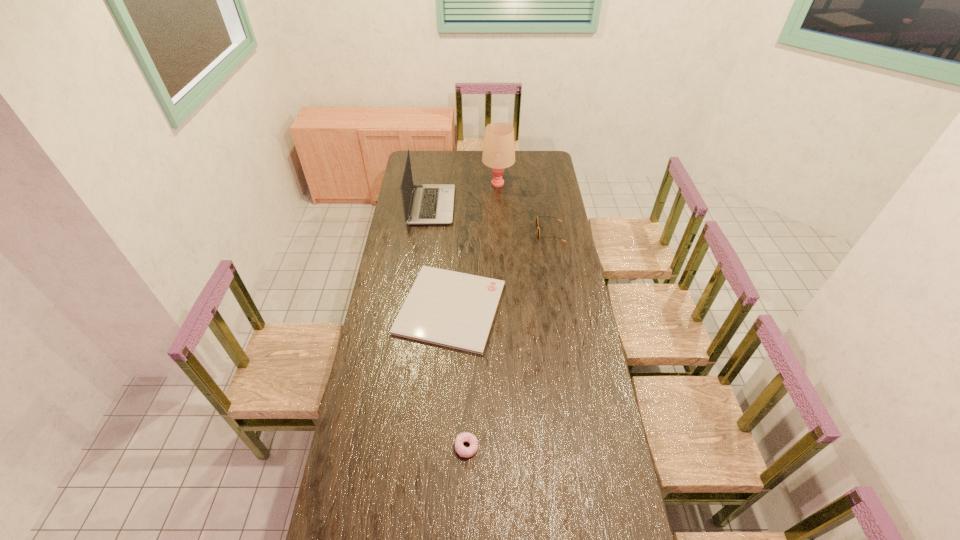
The image size is (960, 540). In order to click on free space in the image that satisfies the following two spatial constraints: 1. on the screen of the doughnut; 2. on the right side of the laptop computer in this screenshot , I will do `click(401, 447)`.

Image resolution: width=960 pixels, height=540 pixels. Find the location of `free space that satisfies the following two spatial constraints: 1. on the screen of the fourth shortest object; 2. on the left side of the fourth tallest object`. free space that satisfies the following two spatial constraints: 1. on the screen of the fourth shortest object; 2. on the left side of the fourth tallest object is located at coordinates (401, 447).

This screenshot has width=960, height=540. In order to click on free region that satisfies the following two spatial constraints: 1. on the screen of the fourth shortest object; 2. on the right side of the second nearest object in this screenshot , I will do `click(419, 308)`.

This screenshot has height=540, width=960. What are the coordinates of `vacant space that satisfies the following two spatial constraints: 1. on the screen of the fourth shortest object; 2. on the back side of the clipboard` in the screenshot? It's located at (419, 308).